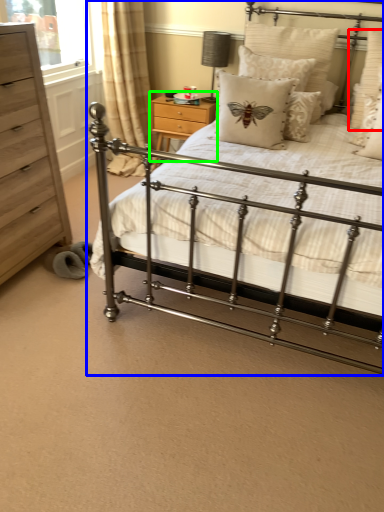
Question: Which object is positioned farthest from pillow (highlighted by a red box)? Select from bed (highlighted by a blue box) and nightstand (highlighted by a green box).

Choices:
 (A) bed
 (B) nightstand

Answer: (B)